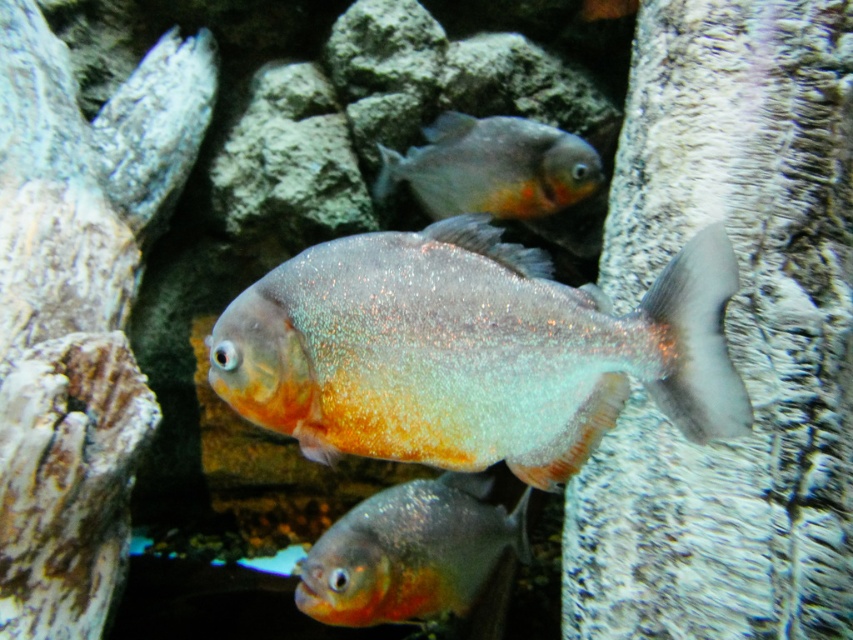
Question: Which point is closer to the camera?

Choices:
 (A) shiny orange fish at upper center
 (B) shiny metallic fish at center
 (C) shiny orange fish at center

Answer: (B)

Question: Is shiny metallic fish at center to the right of shiny orange fish at upper center from the viewer's perspective?

Choices:
 (A) yes
 (B) no

Answer: (B)

Question: Is shiny orange fish at center smaller than shiny orange fish at upper center?

Choices:
 (A) yes
 (B) no

Answer: (A)

Question: Which of the following is the farthest from the observer?

Choices:
 (A) (456, 112)
 (B) (315, 276)

Answer: (A)

Question: Among these objects, which one is nearest to the camera?

Choices:
 (A) shiny orange fish at upper center
 (B) shiny orange fish at center

Answer: (B)

Question: Can you confirm if shiny orange fish at center is positioned to the right of shiny orange fish at upper center?

Choices:
 (A) no
 (B) yes

Answer: (A)